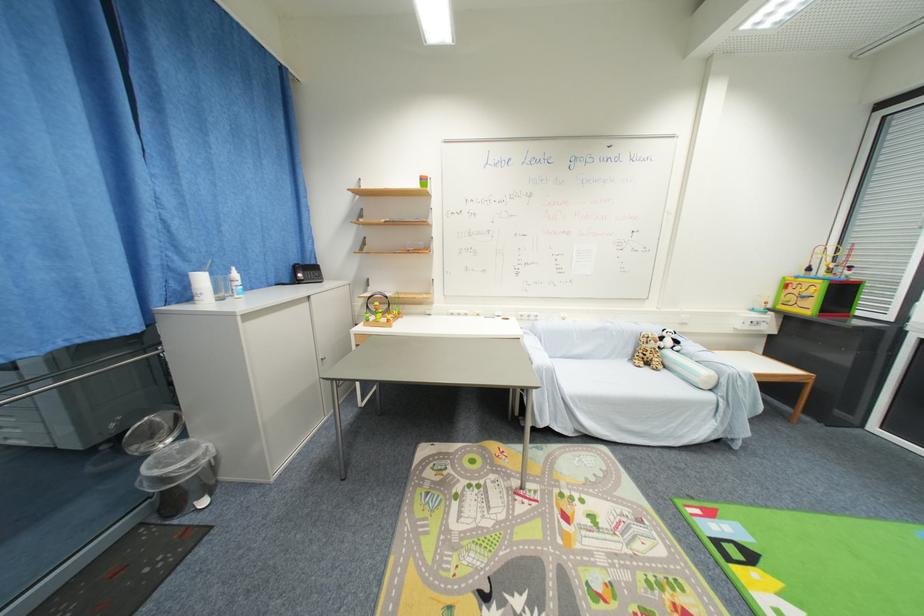
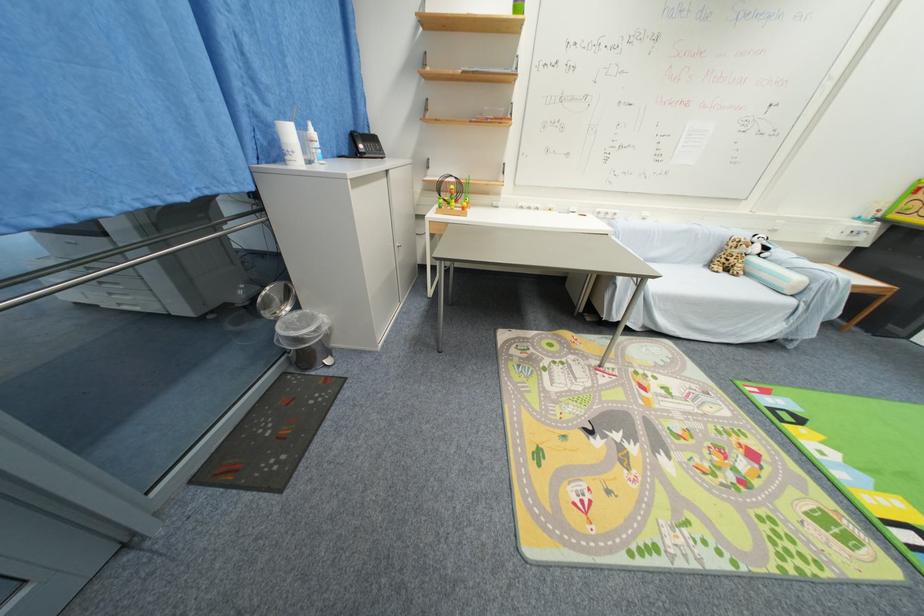
Where in the second image is the point corresponding to (x=638, y=361) from the first image?

(714, 265)